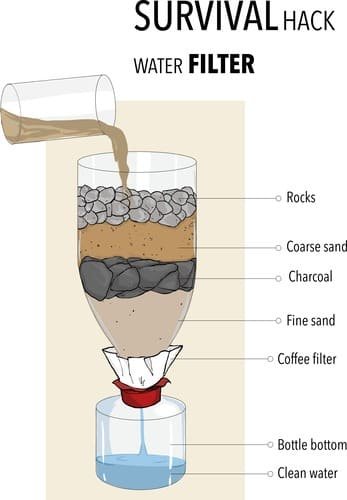
Find the location of a particular element. 'coffee'filter' is located at coordinates (313, 359).